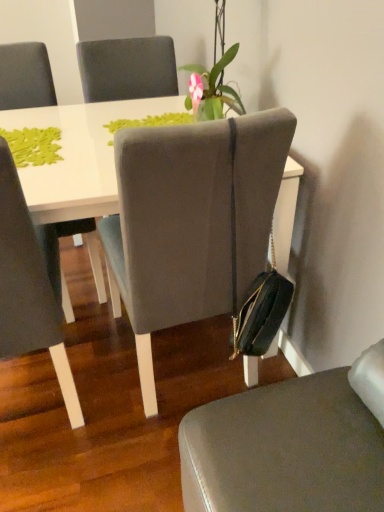
Question: Is the depth of suede-like gray chair at center, placed as the 2th chair when sorted from left to right, less than that of matte gray chair at left, positioned as the third chair in right-to-left order?

Choices:
 (A) no
 (B) yes

Answer: (A)

Question: Is suede-like gray chair at center, which is the second chair in right-to-left order, facing away from matte gray chair at left, positioned as the third chair in right-to-left order?

Choices:
 (A) no
 (B) yes

Answer: (A)

Question: Does suede-like gray chair at center, placed as the 2th chair when sorted from left to right, have a greater height compared to matte gray chair at left, positioned as the third chair in right-to-left order?

Choices:
 (A) yes
 (B) no

Answer: (A)

Question: Is suede-like gray chair at center, which is the second chair in right-to-left order, to the left of matte gray chair at left, positioned as the third chair in right-to-left order, from the viewer's perspective?

Choices:
 (A) yes
 (B) no

Answer: (B)

Question: Can you confirm if suede-like gray chair at center, which is the second chair in right-to-left order, is shorter than matte gray chair at left, the 1th chair viewed from the left?

Choices:
 (A) yes
 (B) no

Answer: (B)

Question: Is suede-like gray chair at center, placed as the 2th chair when sorted from left to right, wider or thinner than matte gray chair at center, which appears as the first chair when viewed from the right?

Choices:
 (A) thin
 (B) wide

Answer: (B)

Question: In terms of height, does suede-like gray chair at center, which is the second chair in right-to-left order, look taller or shorter compared to matte gray chair at center, arranged as the 3th chair when viewed from the left?

Choices:
 (A) short
 (B) tall

Answer: (B)

Question: Do you think suede-like gray chair at center, placed as the 2th chair when sorted from left to right, is within matte gray chair at center, which appears as the first chair when viewed from the right, or outside of it?

Choices:
 (A) inside
 (B) outside

Answer: (B)

Question: Relative to matte gray chair at center, arranged as the 3th chair when viewed from the left, is suede-like gray chair at center, placed as the 2th chair when sorted from left to right, in front or behind?

Choices:
 (A) behind
 (B) front

Answer: (A)

Question: From a real-world perspective, is green matte plant at upper center physically located above or below suede-like gray chair at center, which is the second chair in right-to-left order?

Choices:
 (A) above
 (B) below

Answer: (A)

Question: Is green matte plant at upper center in front of or behind suede-like gray chair at center, placed as the 2th chair when sorted from left to right, in the image?

Choices:
 (A) behind
 (B) front

Answer: (A)

Question: Is green matte plant at upper center bigger or smaller than suede-like gray chair at center, which is the second chair in right-to-left order?

Choices:
 (A) small
 (B) big

Answer: (A)

Question: Considering the positions of green matte plant at upper center and suede-like gray chair at center, placed as the 2th chair when sorted from left to right, in the image, is green matte plant at upper center taller or shorter than suede-like gray chair at center, placed as the 2th chair when sorted from left to right,?

Choices:
 (A) short
 (B) tall

Answer: (A)

Question: From their relative heights in the image, would you say matte gray chair at left, the 1th chair viewed from the left, is taller or shorter than suede-like gray chair at center, which is the second chair in right-to-left order?

Choices:
 (A) short
 (B) tall

Answer: (A)

Question: From the image's perspective, is matte gray chair at left, the 1th chair viewed from the left, above or below suede-like gray chair at center, which is the second chair in right-to-left order?

Choices:
 (A) below
 (B) above

Answer: (A)